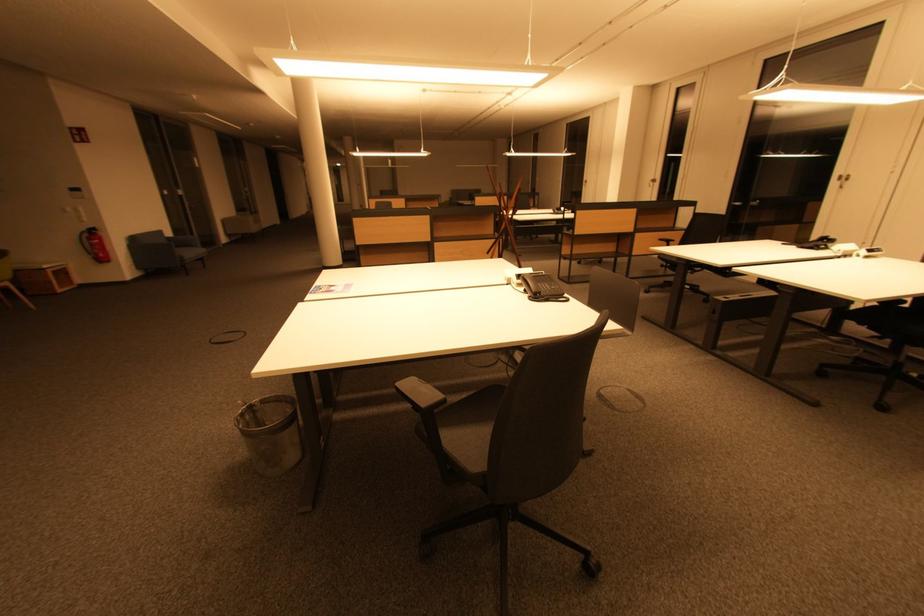
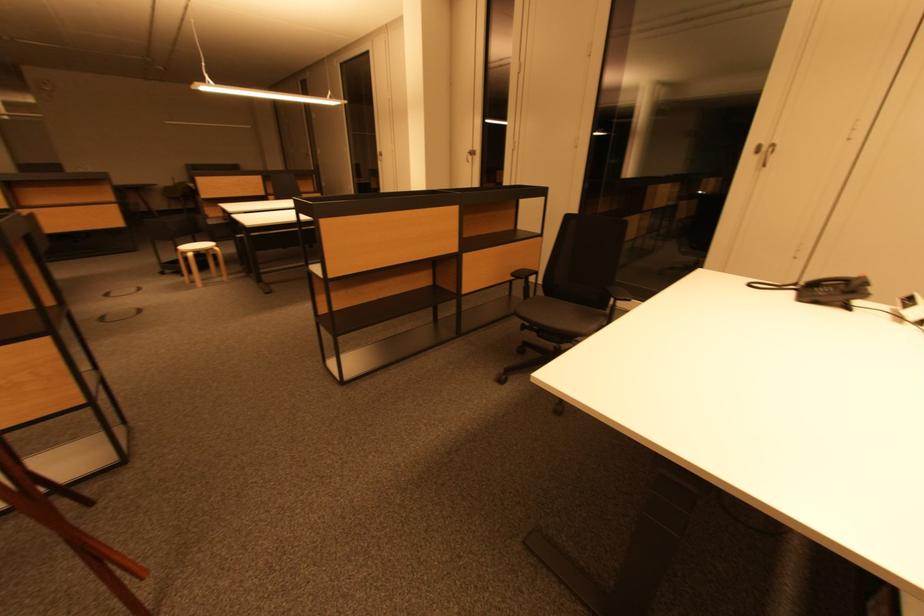
Where in the second image is the point corresponding to (849,180) from the first image?

(767, 150)